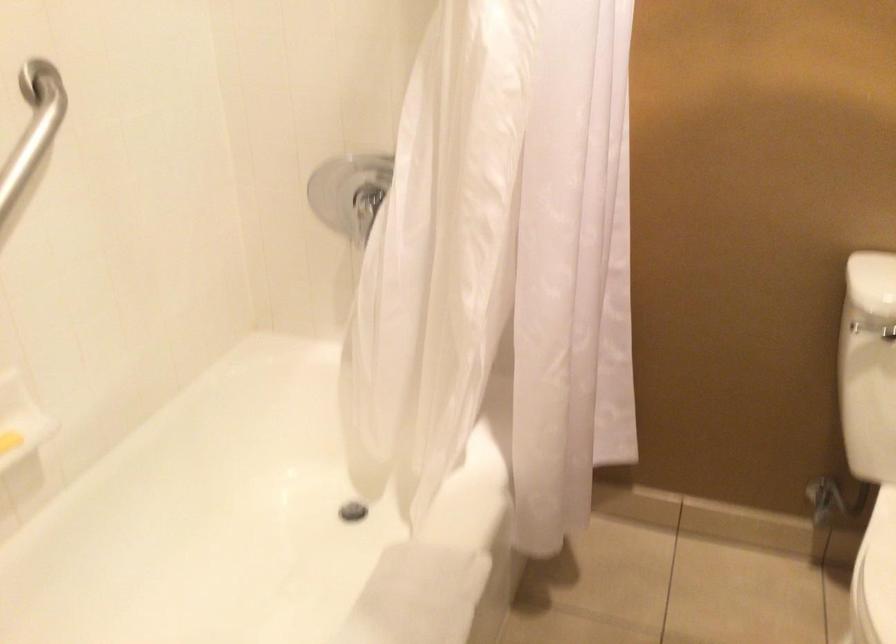
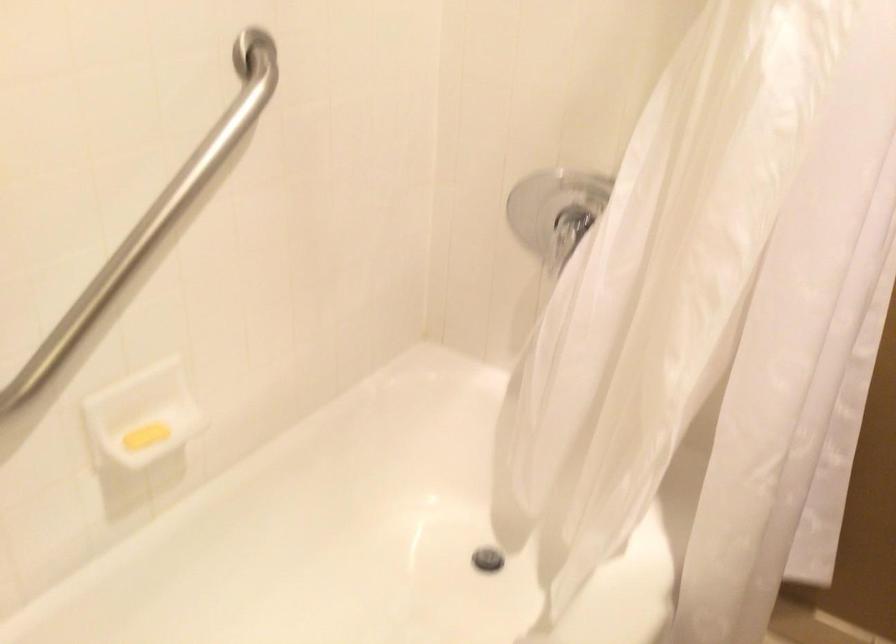
The images are taken continuously from a first-person perspective. In which direction are you moving?

The movement direction of the cameraman is left, forward.